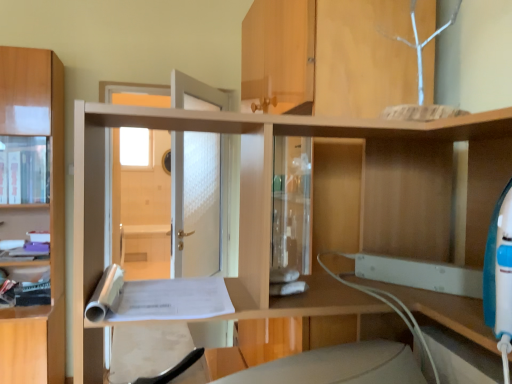
This screenshot has height=384, width=512. What do you see at coordinates (35, 213) in the screenshot? I see `light brown wood cabinet at left` at bounding box center [35, 213].

The width and height of the screenshot is (512, 384). In order to click on light brown wood cabinet at left in this screenshot , I will do `click(35, 213)`.

This screenshot has height=384, width=512. I want to click on matte wood cabinet at left, so click(24, 169).

What do you see at coordinates (24, 169) in the screenshot? The image size is (512, 384). I see `matte wood cabinet at left` at bounding box center [24, 169].

Locate an element on the screen. Image resolution: width=512 pixels, height=384 pixels. light brown wood cabinet at left is located at coordinates (35, 213).

Which object is positioned more to the right, matte wood cabinet at left or light brown wood cabinet at left?

light brown wood cabinet at left is more to the right.

Relative to light brown wood cabinet at left, is matte wood cabinet at left in front or behind?

matte wood cabinet at left is positioned farther from the viewer than light brown wood cabinet at left.

Is point (28, 158) positioned before point (58, 357)?

No, (28, 158) is behind (58, 357).

From the image's perspective, is matte wood cabinet at left on top of light brown wood cabinet at left?

Yes, from the image's perspective, matte wood cabinet at left is above light brown wood cabinet at left.

From a real-world perspective, is matte wood cabinet at left physically above light brown wood cabinet at left?

Yes, from a real-world perspective, matte wood cabinet at left is on top of light brown wood cabinet at left.

Between matte wood cabinet at left and light brown wood cabinet at left, which one has smaller width?

With smaller width is matte wood cabinet at left.

Considering the sizes of objects matte wood cabinet at left and light brown wood cabinet at left in the image provided, who is taller, matte wood cabinet at left or light brown wood cabinet at left?

With more height is light brown wood cabinet at left.

Between matte wood cabinet at left and light brown wood cabinet at left, which one has larger size?

With larger size is light brown wood cabinet at left.

Could light brown wood cabinet at left be considered to be inside matte wood cabinet at left?

Definitely not — light brown wood cabinet at left is not inside matte wood cabinet at left.

Does matte wood cabinet at left touch light brown wood cabinet at left?

No.

Is matte wood cabinet at left looking in the opposite direction of light brown wood cabinet at left?

Absolutely, matte wood cabinet at left is directed away from light brown wood cabinet at left.

Can you tell me how much matte wood cabinet at left and light brown wood cabinet at left differ in facing direction?

The angular difference between matte wood cabinet at left and light brown wood cabinet at left is 0.508 degrees.

Where is `cabinetry that is in front of the matte wood cabinet at left`? This screenshot has height=384, width=512. cabinetry that is in front of the matte wood cabinet at left is located at coordinates (x=35, y=213).

Considering the relative positions of light brown wood cabinet at left and matte wood cabinet at left in the image provided, is light brown wood cabinet at left to the right of matte wood cabinet at left from the viewer's perspective?

Yes.

Is light brown wood cabinet at left in front of matte wood cabinet at left?

Yes, light brown wood cabinet at left is closer to the viewer.

Considering the positions of point (64, 325) and point (18, 137), is point (64, 325) closer or farther from the camera than point (18, 137)?

Point (64, 325) is closer to the camera than point (18, 137).

From the image's perspective, is light brown wood cabinet at left beneath matte wood cabinet at left?

Indeed, from the image's perspective, light brown wood cabinet at left is shown beneath matte wood cabinet at left.

From a real-world perspective, is light brown wood cabinet at left on top of matte wood cabinet at left?

No, from a real-world perspective, light brown wood cabinet at left is not over matte wood cabinet at left

Does light brown wood cabinet at left have a lesser width compared to matte wood cabinet at left?

No.

Which of these two, light brown wood cabinet at left or matte wood cabinet at left, stands taller?

With more height is light brown wood cabinet at left.

Does light brown wood cabinet at left have a smaller size compared to matte wood cabinet at left?

No, light brown wood cabinet at left is not smaller than matte wood cabinet at left.

Can we say light brown wood cabinet at left lies outside matte wood cabinet at left?

That's correct, light brown wood cabinet at left is outside of matte wood cabinet at left.

Is light brown wood cabinet at left far away from matte wood cabinet at left?

No, light brown wood cabinet at left is not far from matte wood cabinet at left.

Is matte wood cabinet at left at the back of light brown wood cabinet at left?

Absolutely, light brown wood cabinet at left is directed away from matte wood cabinet at left.

Locate an element on the screen. cabinetry below the matte wood cabinet at left (from the image's perspective) is located at coordinates (35, 213).

In the image, there is a matte wood cabinet at left. Where is `cabinetry below it (from the image's perspective)`? Image resolution: width=512 pixels, height=384 pixels. cabinetry below it (from the image's perspective) is located at coordinates (35, 213).

What are the coordinates of `cabinetry to the right of matte wood cabinet at left` in the screenshot? It's located at (35, 213).